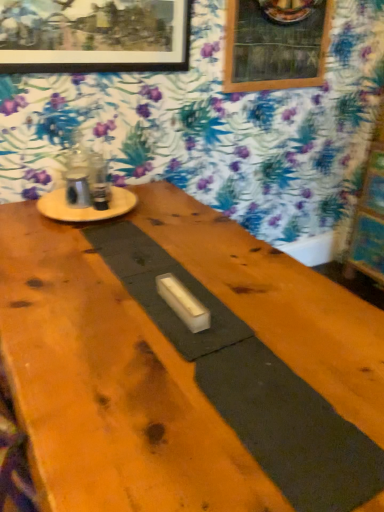
Question: In terms of height, does wooden round table at upper left look taller or shorter compared to wooden picture frame at upper center, positioned as the first picture frame in back-to-front order?

Choices:
 (A) short
 (B) tall

Answer: (A)

Question: Would you say wooden round table at upper left is to the left or to the right of wooden picture frame at upper center, the first picture frame from the right, in the picture?

Choices:
 (A) left
 (B) right

Answer: (A)

Question: Based on their relative distances, which object is nearer to the wooden picture frame at upper center, the 2th picture frame positioned from the front?

Choices:
 (A) wooden picture frame at upper left, the 2th picture frame from the right
 (B) wooden round table at upper left
 (C) wooden bulletin board at right
 (D) smooth wood table at center

Answer: (A)

Question: Which object is the closest to the wooden picture frame at upper left, the first picture frame viewed from the left?

Choices:
 (A) wooden bulletin board at right
 (B) smooth wood table at center
 (C) wooden picture frame at upper center, the first picture frame from the right
 (D) wooden round table at upper left

Answer: (C)